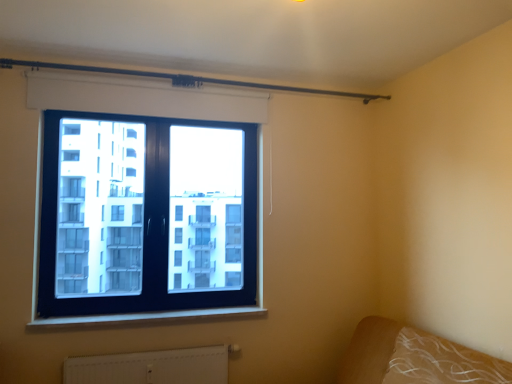
Question: Could you tell me if black glass window at upper left is facing white plastic window sill at lower center?

Choices:
 (A) no
 (B) yes

Answer: (A)

Question: Is the surface of black glass window at upper left in direct contact with white plastic window sill at lower center?

Choices:
 (A) no
 (B) yes

Answer: (A)

Question: Is black glass window at upper left thinner than white plastic window sill at lower center?

Choices:
 (A) no
 (B) yes

Answer: (B)

Question: From the image's perspective, is black glass window at upper left on white plastic window sill at lower center?

Choices:
 (A) no
 (B) yes

Answer: (B)

Question: From a real-world perspective, does black glass window at upper left sit lower than white plastic window sill at lower center?

Choices:
 (A) no
 (B) yes

Answer: (A)

Question: Does black glass window at upper left have a greater height compared to white plastic window sill at lower center?

Choices:
 (A) no
 (B) yes

Answer: (B)

Question: Would you say white textured radiator at lower center is a long distance from metallic rod at upper center?

Choices:
 (A) yes
 (B) no

Answer: (A)

Question: From the image's perspective, does white textured radiator at lower center appear higher than metallic rod at upper center?

Choices:
 (A) no
 (B) yes

Answer: (A)

Question: Is white textured radiator at lower center in contact with metallic rod at upper center?

Choices:
 (A) no
 (B) yes

Answer: (A)

Question: From the image's perspective, is white textured radiator at lower center located beneath metallic rod at upper center?

Choices:
 (A) yes
 (B) no

Answer: (A)

Question: Can you confirm if white textured radiator at lower center is taller than metallic rod at upper center?

Choices:
 (A) yes
 (B) no

Answer: (A)

Question: Considering the relative sizes of white textured radiator at lower center and metallic rod at upper center in the image provided, is white textured radiator at lower center smaller than metallic rod at upper center?

Choices:
 (A) no
 (B) yes

Answer: (A)

Question: Is metallic rod at upper center positioned behind brown fabric bed at lower right?

Choices:
 (A) yes
 (B) no

Answer: (A)